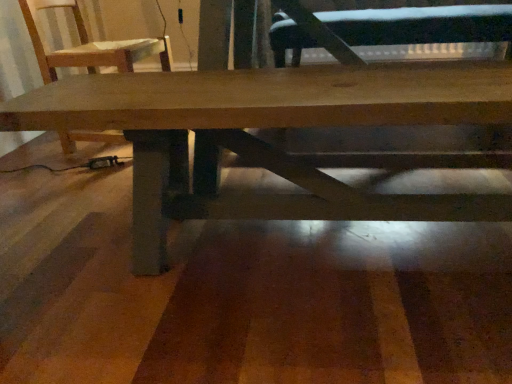
Question: Based on their sizes in the image, would you say wooden chair at upper left is bigger or smaller than natural wood table at center?

Choices:
 (A) big
 (B) small

Answer: (B)

Question: From their relative heights in the image, would you say wooden chair at upper left is taller or shorter than natural wood table at center?

Choices:
 (A) tall
 (B) short

Answer: (A)

Question: Which of these objects is positioned closest to the wooden chair at upper left?

Choices:
 (A) natural wood table at center
 (B) black leather swivel chair at center

Answer: (A)

Question: Which object is the farthest from the natural wood table at center?

Choices:
 (A) wooden chair at upper left
 (B) black leather swivel chair at center

Answer: (B)